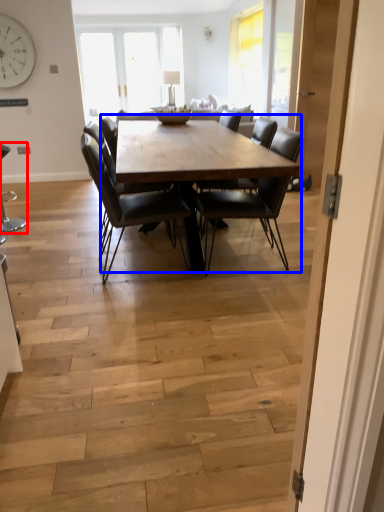
Question: Which point is closer to the camera, chair (highlighted by a red box) or coffee table (highlighted by a blue box)?

Choices:
 (A) chair
 (B) coffee table

Answer: (B)